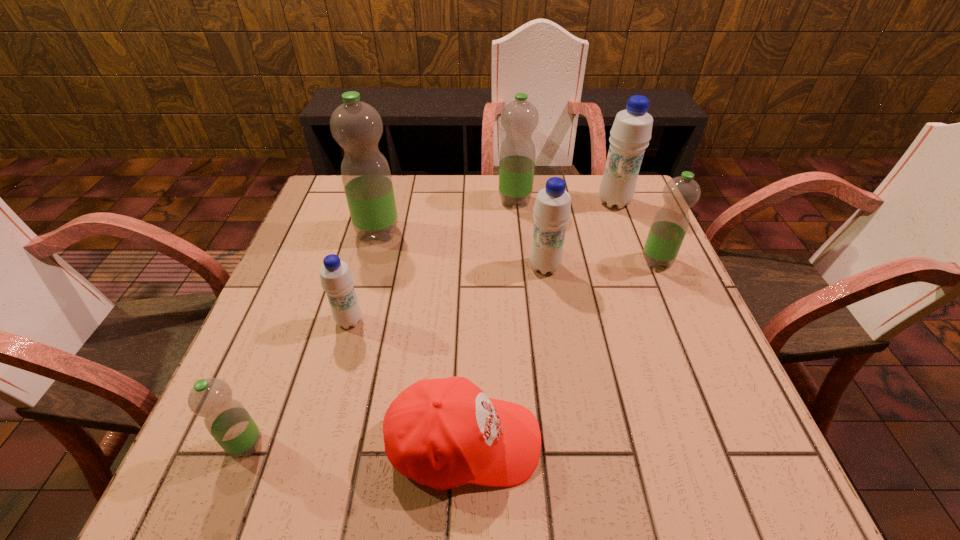
Find the location of a particular element. free location located on the left of the second nearest water bottle is located at coordinates (307, 321).

Identify the location of free space located on the right of the nearest green water bottle. The height and width of the screenshot is (540, 960). click(317, 444).

Locate an element on the screen. free space located 0.060m on the front panel of the shortest object is located at coordinates (576, 442).

Identify the location of water bottle located at the near edge. The width and height of the screenshot is (960, 540). (226, 419).

This screenshot has height=540, width=960. What are the coordinates of `baseball cap located in the near edge section of the desktop` in the screenshot? It's located at click(443, 433).

Identify the location of object that is at the far left corner. The height and width of the screenshot is (540, 960). (356, 126).

This screenshot has height=540, width=960. Identify the location of object that is at the near left corner. 226,419.

In order to click on object located in the far right corner section of the desktop in this screenshot , I will do `click(631, 132)`.

Identify the location of free space at the far edge. The image size is (960, 540). (526, 217).

In the image, there is a desktop. Where is `vacant space at the left edge`? Image resolution: width=960 pixels, height=540 pixels. vacant space at the left edge is located at coordinates (309, 238).